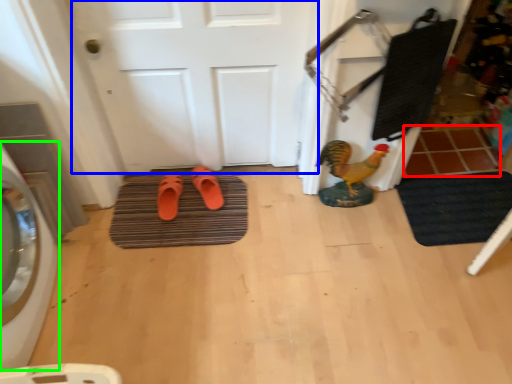
Question: Based on their relative distances, which object is nearer to tile (highlighted by a red box)? Choose from door (highlighted by a blue box) and washing machine (highlighted by a green box).

Choices:
 (A) door
 (B) washing machine

Answer: (A)